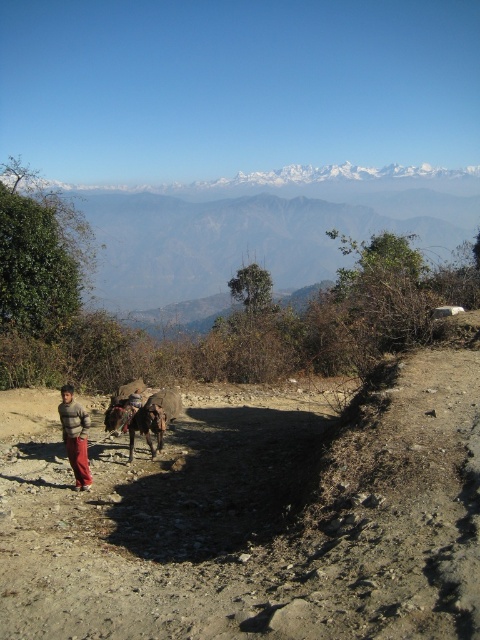
Can you confirm if snowy rocky mountain at upper center is positioned below brown fuzzy donkey at center?

Incorrect, snowy rocky mountain at upper center is not positioned below brown fuzzy donkey at center.

Does snowy rocky mountain at upper center have a greater width compared to brown fuzzy donkey at center?

Yes.

Who is more forward, (316, 168) or (149, 438)?

Point (149, 438)

This screenshot has width=480, height=640. Find the location of `snowy rocky mountain at upper center`. snowy rocky mountain at upper center is located at coordinates (254, 225).

Between point (142, 250) and point (68, 451), which one is positioned behind?

The point (142, 250) is more distant.

Is point (152, 298) positioned before point (76, 417)?

No, it is behind (76, 417).

Between point (299, 234) and point (80, 486), which one is positioned in front?

Positioned in front is point (80, 486).

The height and width of the screenshot is (640, 480). I want to click on snowy rocky mountain at upper center, so click(x=254, y=225).

Does point (75, 474) lie behind point (164, 417)?

No, it is in front of (164, 417).

In the scene shown: Who is positioned more to the right, knitted sweater at lower left or brown fuzzy donkey at center?

From the viewer's perspective, brown fuzzy donkey at center appears more on the right side.

Measure the distance between knitted sweater at lower left and camera.

knitted sweater at lower left and camera are 8.32 meters apart.

The width and height of the screenshot is (480, 640). In order to click on knitted sweater at lower left in this screenshot , I will do `click(74, 436)`.